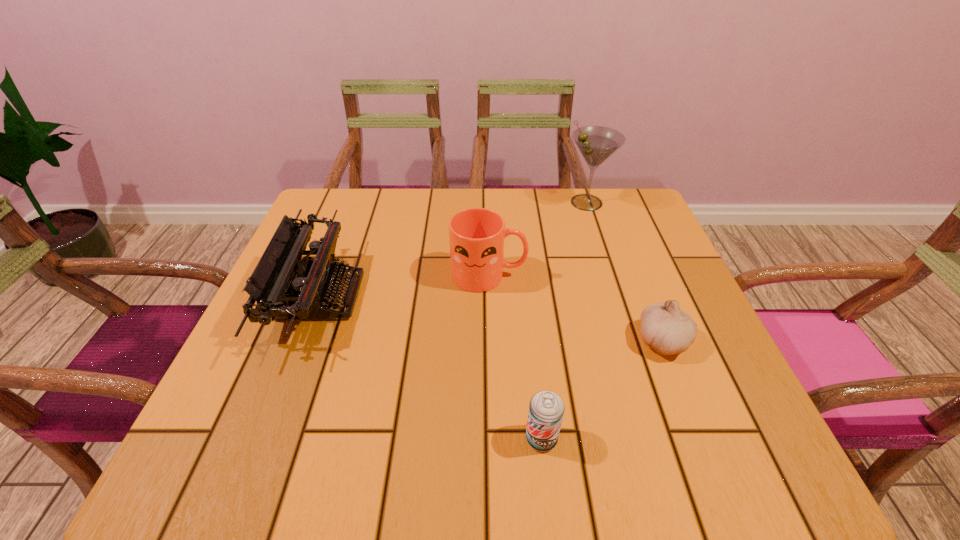
The width and height of the screenshot is (960, 540). I want to click on vacant area at the right edge of the desktop, so click(x=684, y=409).

Locate an element on the screen. The width and height of the screenshot is (960, 540). vacant space at the far left corner is located at coordinates (370, 210).

Find the location of a particular element. The width and height of the screenshot is (960, 540). vacant area at the near left corner of the desktop is located at coordinates (274, 480).

The height and width of the screenshot is (540, 960). Find the location of `free space between the mug and the garlic`. free space between the mug and the garlic is located at coordinates (576, 308).

This screenshot has height=540, width=960. I want to click on empty space that is in between the leftmost object and the beer can, so click(x=431, y=368).

Image resolution: width=960 pixels, height=540 pixels. I want to click on unoccupied position between the beer can and the farthest object, so click(564, 320).

Where is `empty space between the garlic and the mug`? This screenshot has height=540, width=960. empty space between the garlic and the mug is located at coordinates (576, 308).

I want to click on vacant area that lies between the typewriter and the mug, so click(404, 286).

Find the location of a particular element. free spot between the garlic and the typewriter is located at coordinates (492, 319).

Identify the location of vacant space that's between the garlic and the leftmost object. Image resolution: width=960 pixels, height=540 pixels. (492, 319).